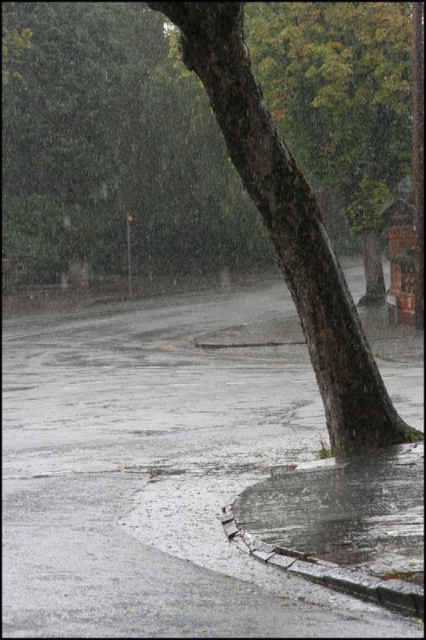
Is wet asphalt at lower center taller than smooth brown tree trunk at center?

No, wet asphalt at lower center is not taller than smooth brown tree trunk at center.

Does point (34, 632) come farther from viewer compared to point (218, 112)?

No, (34, 632) is closer to viewer.

At what (x,y) coordinates should I click in order to perform the action: click on wet asphalt at lower center. Please return your answer as a coordinate pair (x, y). The width and height of the screenshot is (426, 640). Looking at the image, I should click on (155, 474).

Can you confirm if wet asphalt at lower center is wider than glossy concrete puddle at lower center?

Yes.

Does wet asphalt at lower center have a larger size compared to glossy concrete puddle at lower center?

Correct, wet asphalt at lower center is larger in size than glossy concrete puddle at lower center.

What do you see at coordinates (155, 474) in the screenshot? I see `wet asphalt at lower center` at bounding box center [155, 474].

The height and width of the screenshot is (640, 426). In order to click on wet asphalt at lower center in this screenshot , I will do `click(155, 474)`.

Can you confirm if smooth bark tree at center is bigger than glossy concrete puddle at lower center?

Yes.

Does smooth bark tree at center come behind glossy concrete puddle at lower center?

Yes, smooth bark tree at center is behind glossy concrete puddle at lower center.

Between point (160, 262) and point (347, 545), which one is positioned behind?

Positioned behind is point (160, 262).

Identify the location of smooth bark tree at center. Image resolution: width=426 pixels, height=640 pixels. (112, 147).